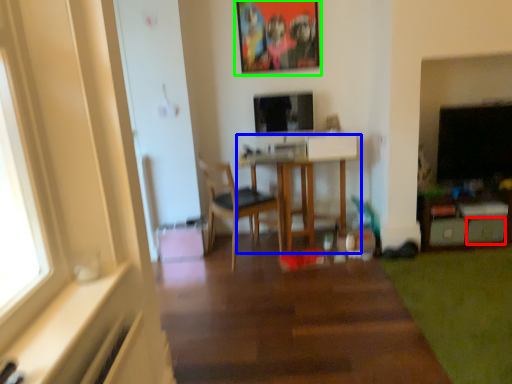
Question: Which is nearer to the drawer (highlighted by a red box)? table (highlighted by a blue box) or picture frame (highlighted by a green box).

Choices:
 (A) table
 (B) picture frame

Answer: (A)